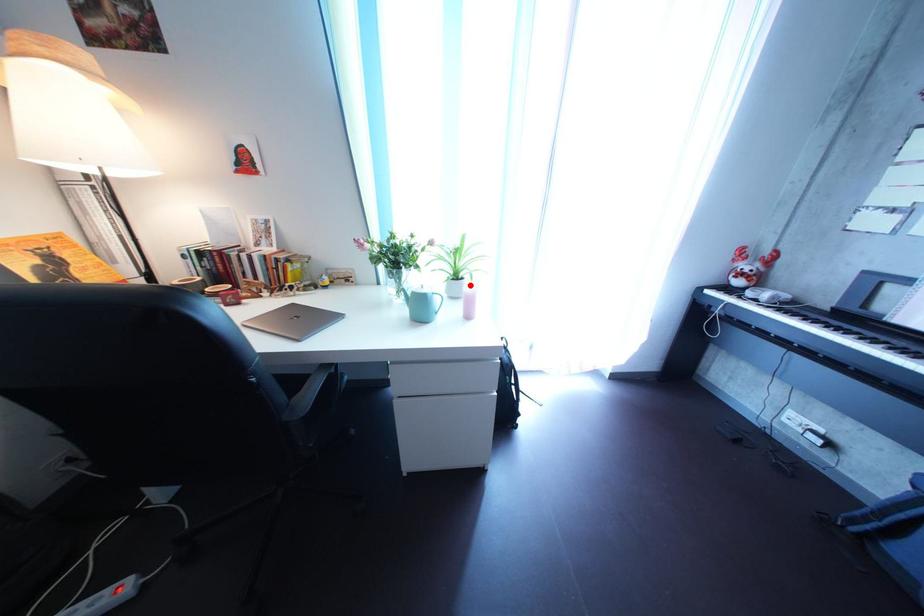
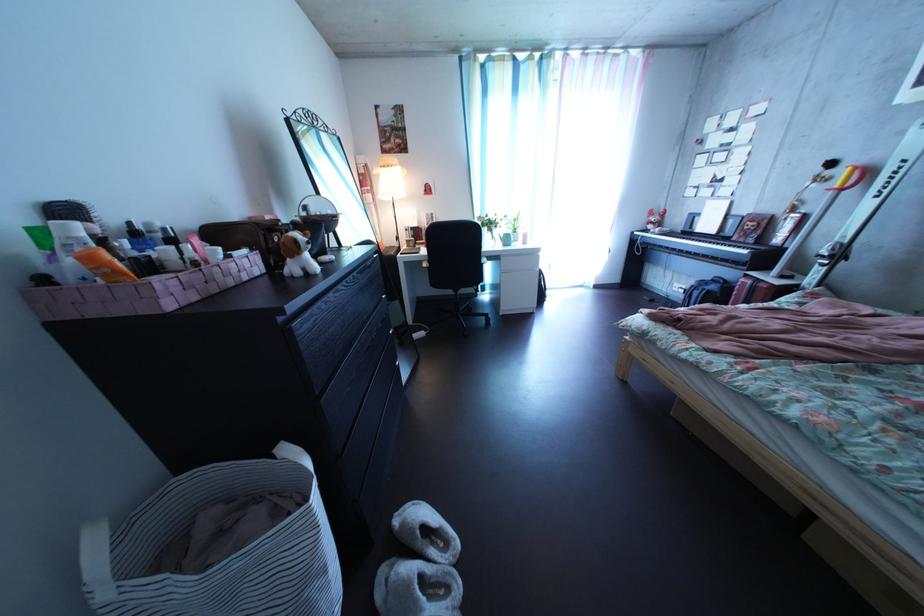
Locate, in the second image, the point that corresponds to the highlighted location in the first image.

(529, 240)